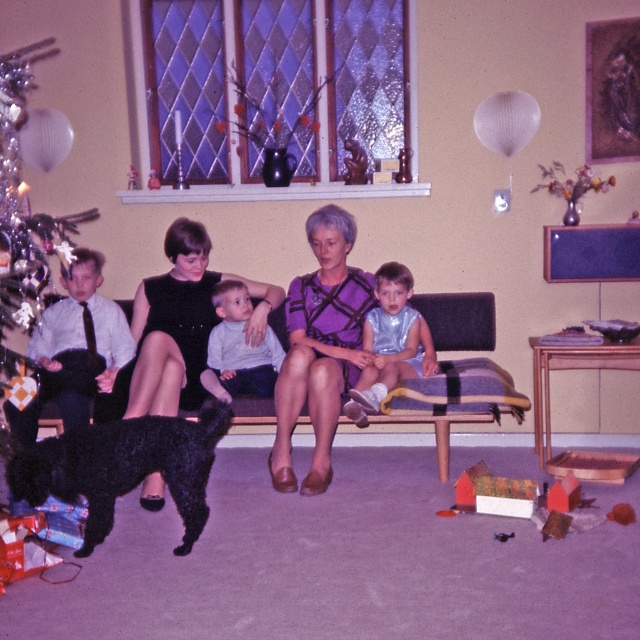
Looking at this image, can you confirm if shiny black dog at lower left is positioned to the right of light gray cotton shirt at center?

Indeed, shiny black dog at lower left is positioned on the right side of light gray cotton shirt at center.

Where is `shiny black dog at lower left`? The image size is (640, 640). shiny black dog at lower left is located at coordinates (323, 392).

Is black fuzzy dog at lower left positioned at the back of shiny silver outfit at center?

No.

Is point (168, 477) closer to camera compared to point (368, 396)?

Yes, it is in front of point (368, 396).

Is point (157, 445) closer to camera compared to point (388, 272)?

Yes, it is.

Find the location of `black fuzzy dog at lower left`. black fuzzy dog at lower left is located at coordinates coord(124,467).

Can you confirm if shiny silver ornaments at left is positioned to the left of light gray cotton shirt at center?

Yes, shiny silver ornaments at left is to the left of light gray cotton shirt at center.

Who is more forward, (38,259) or (260,376)?

Point (38,259) is more forward.

Locate an element on the screen. This screenshot has width=640, height=640. shiny silver ornaments at left is located at coordinates (22, 209).